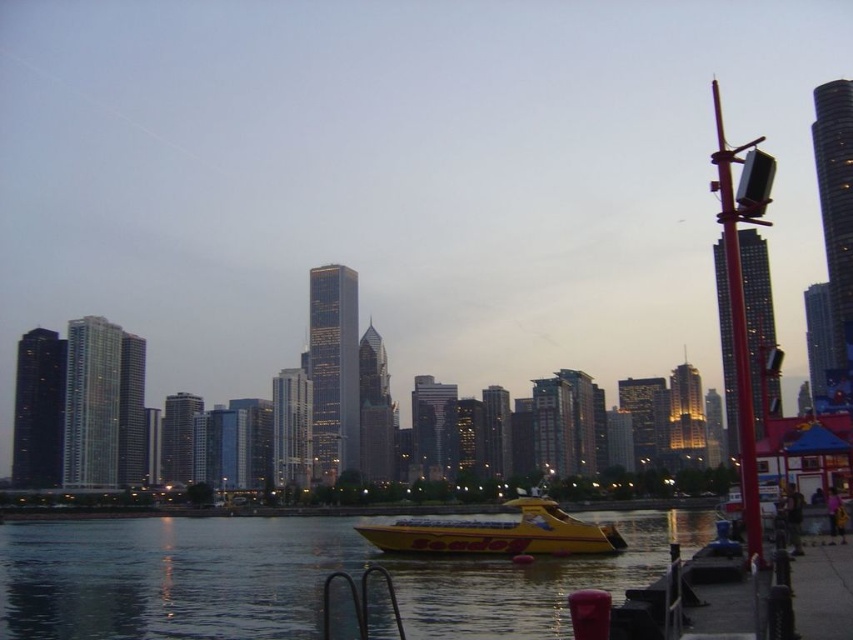
In the scene shown: You are standing at the edge of the waterfront and want to walk towards the point labeled as point (x=22, y=592). However, there is an obstacle at point (x=558, y=554). Will you encounter this obstacle before reaching your destination?

Point (x=22, y=592) is in front of point (x=558, y=554), so you will reach the destination before encountering the obstacle.

You are a photographer trying to capture the sunset reflection on the water. You want to frame both the transparent water at center and the yellow matte seadog at center in your shot. Which object should you position closer to the left side of your camera frame?

You should position the transparent water at center closer to the left side of your camera frame since it is already located to the left of the yellow matte seadog at center in the scene.

Based on the photo, you are standing on the dock and want to board the yellow matte seadog at center. The transparent water at center is where the boat is currently located. Can you safely walk from your current position on the dock to the boat without getting wet?

The distance between transparent water at center and yellow matte dog at center is 98.03 feet, so you cannot safely walk to the boat as the distance is too large and the water is in between.